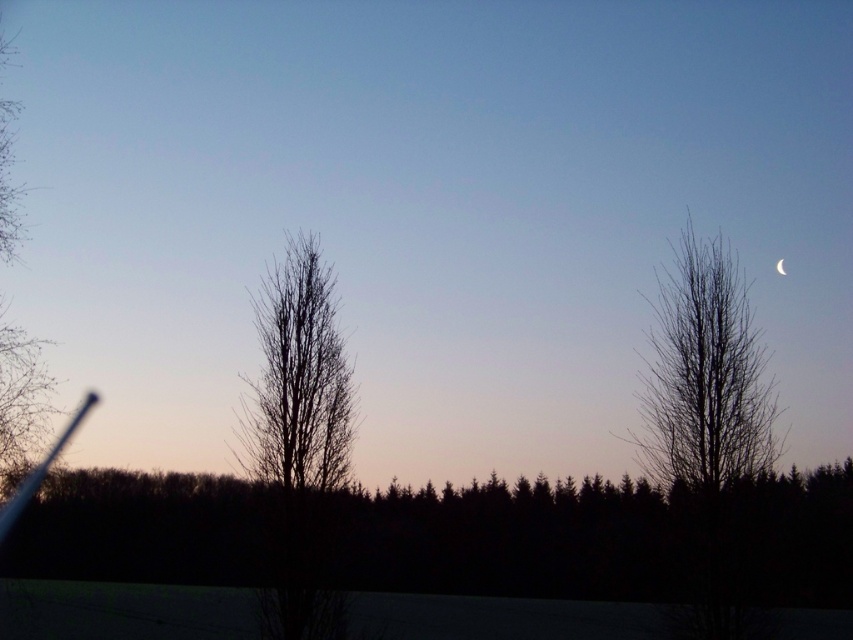
Question: Can you confirm if brown/dry wood tree at center is bigger than silvery metallic crescent at upper center?

Choices:
 (A) no
 (B) yes

Answer: (B)

Question: From the image, what is the correct spatial relationship of brown/dry wood tree at center in relation to silhouette bare tree at left?

Choices:
 (A) below
 (B) above

Answer: (A)

Question: Among these points, which one is farthest from the camera?

Choices:
 (A) (250, 467)
 (B) (45, 422)

Answer: (B)

Question: Which object is farther from the camera taking this photo?

Choices:
 (A) brown/dry wood tree at center
 (B) silvery metallic crescent at upper center
 (C) silhouette bare tree at left

Answer: (B)

Question: Is bare branches at right positioned before silhouette bare tree at left?

Choices:
 (A) no
 (B) yes

Answer: (B)

Question: Which of the following is the closest to the observer?

Choices:
 (A) silhouette bare tree at left
 (B) bare branches at right

Answer: (B)